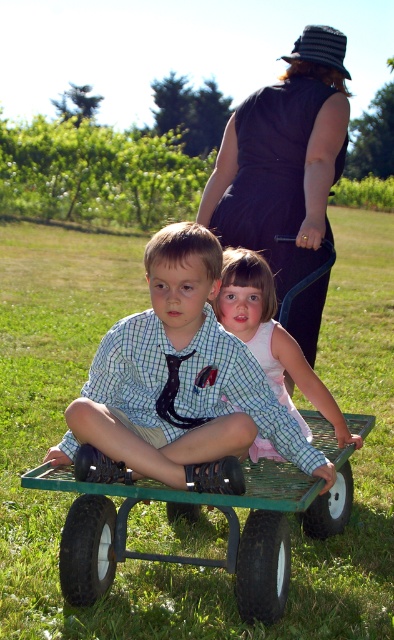
Question: Does checkered fabric shirt at center appear on the left side of green metal wagon at center?

Choices:
 (A) yes
 (B) no

Answer: (A)

Question: Is checkered fabric shirt at center thinner than dark blue dress at center?

Choices:
 (A) no
 (B) yes

Answer: (A)

Question: Which point is closer to the camera?

Choices:
 (A) (265, 129)
 (B) (269, 394)
 (C) (254, 340)
 (D) (262, 472)

Answer: (B)

Question: Which object is closer to the camera taking this photo?

Choices:
 (A) dark blue dress at center
 (B) pink satin dress at center
 (C) green metal wagon at center

Answer: (C)

Question: Which object is positioned closest to the dark blue dress at center?

Choices:
 (A) checkered fabric shirt at center
 (B) pink satin dress at center

Answer: (B)

Question: Does checkered fabric shirt at center have a smaller size compared to dark blue dress at center?

Choices:
 (A) yes
 (B) no

Answer: (A)